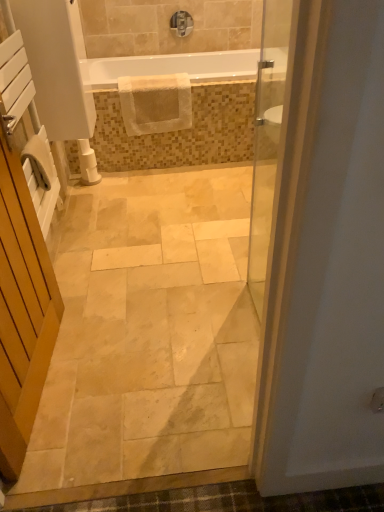
Question: From the image's perspective, is white wooden screen door at left positioned above or below white glossy bathtub at upper center?

Choices:
 (A) above
 (B) below

Answer: (B)

Question: Considering the positions of white wooden screen door at left and white glossy bathtub at upper center in the image, is white wooden screen door at left wider or thinner than white glossy bathtub at upper center?

Choices:
 (A) wide
 (B) thin

Answer: (B)

Question: Which object is the closest to the matte silver faucet at upper center?

Choices:
 (A) natural stone floor at center
 (B) white plastic toilet paper at lower left
 (C) white wooden screen door at left
 (D) white glossy bathtub at upper center
 (E) white textured mat at upper center

Answer: (D)

Question: Estimate the real-world distances between objects in this image. Which object is closer to the matte silver faucet at upper center?

Choices:
 (A) white plastic toilet paper at lower left
 (B) white glossy bathtub at upper center
 (C) natural stone floor at center
 (D) white textured mat at upper center
 (E) white wooden screen door at left

Answer: (B)